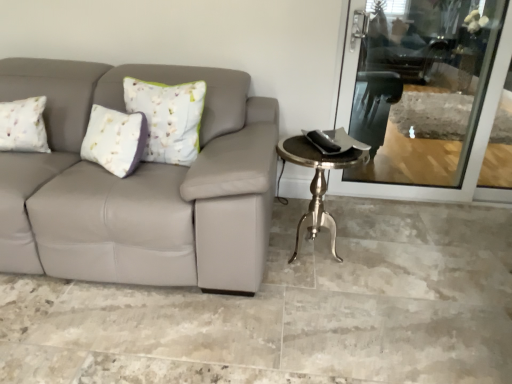
Identify the location of vacant location below silver metallic table at right (from a real-world perspective). This screenshot has width=512, height=384. (312, 260).